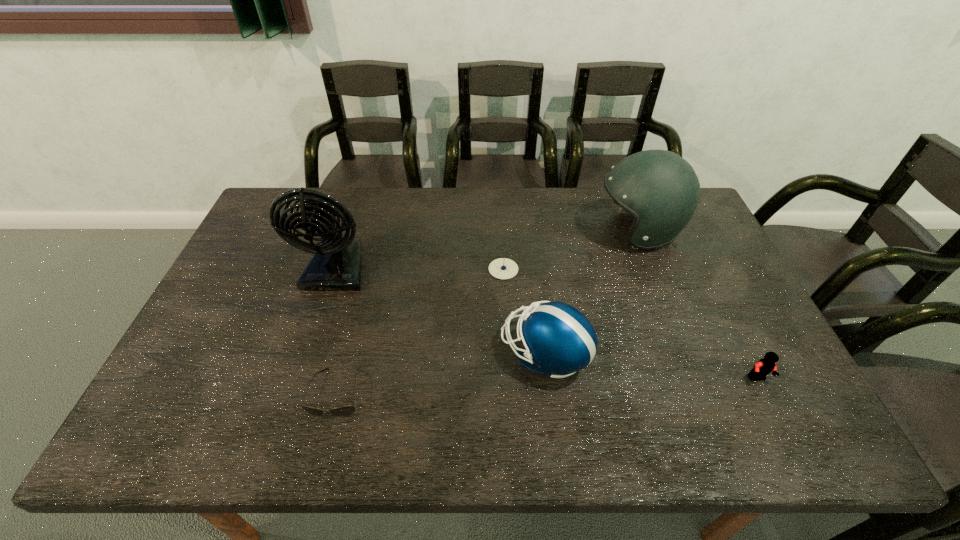
The height and width of the screenshot is (540, 960). I want to click on Lego present at the right edge, so pos(765,366).

This screenshot has width=960, height=540. Find the location of `object that is at the far right corner`. object that is at the far right corner is located at coordinates 661,190.

In the image, there is a desktop. At what (x,y) coordinates should I click in order to perform the action: click on vacant space at the far edge. Please return your answer as a coordinate pair (x, y). This screenshot has width=960, height=540. Looking at the image, I should click on (547, 195).

Locate an element on the screen. The width and height of the screenshot is (960, 540). free point at the left edge is located at coordinates pyautogui.click(x=217, y=389).

This screenshot has width=960, height=540. What are the coordinates of `blank space at the right edge of the desktop` in the screenshot? It's located at (709, 237).

In order to click on vacant space at the near left corner of the desktop in this screenshot , I will do `click(145, 437)`.

Locate an element on the screen. Image resolution: width=960 pixels, height=540 pixels. unoccupied area between the fourth shortest object and the farther football helmet is located at coordinates (591, 292).

The width and height of the screenshot is (960, 540). In order to click on vacant space that's between the fan and the sunglasses in this screenshot , I will do `click(337, 330)`.

Image resolution: width=960 pixels, height=540 pixels. What are the coordinates of `free space between the taller football helmet and the shorter football helmet` in the screenshot? It's located at (591, 292).

This screenshot has width=960, height=540. Find the location of `blank region between the shorter football helmet and the fan`. blank region between the shorter football helmet and the fan is located at coordinates (441, 310).